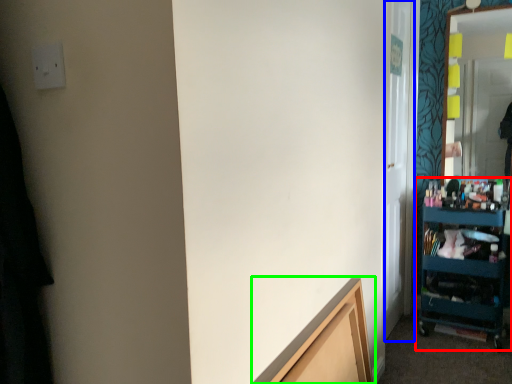
Question: Which object is positioned closest to shelf (highlighted by a red box)? Select from glass door (highlighted by a blue box) and cabinetry (highlighted by a green box).

Choices:
 (A) glass door
 (B) cabinetry

Answer: (A)